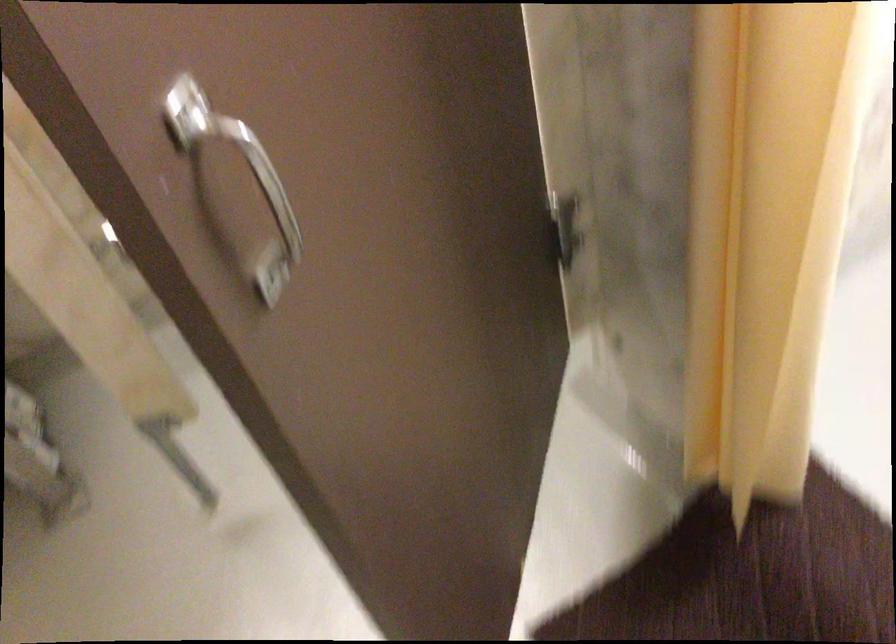
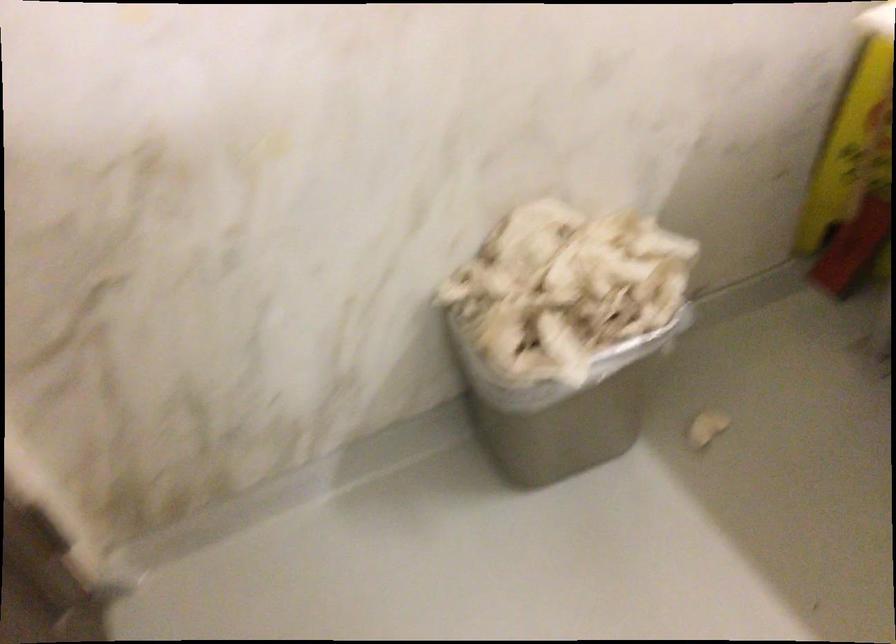
The first image is from the beginning of the video and the second image is from the end. How did the camera likely rotate when shooting the video?

The camera's rotation is toward left-down.